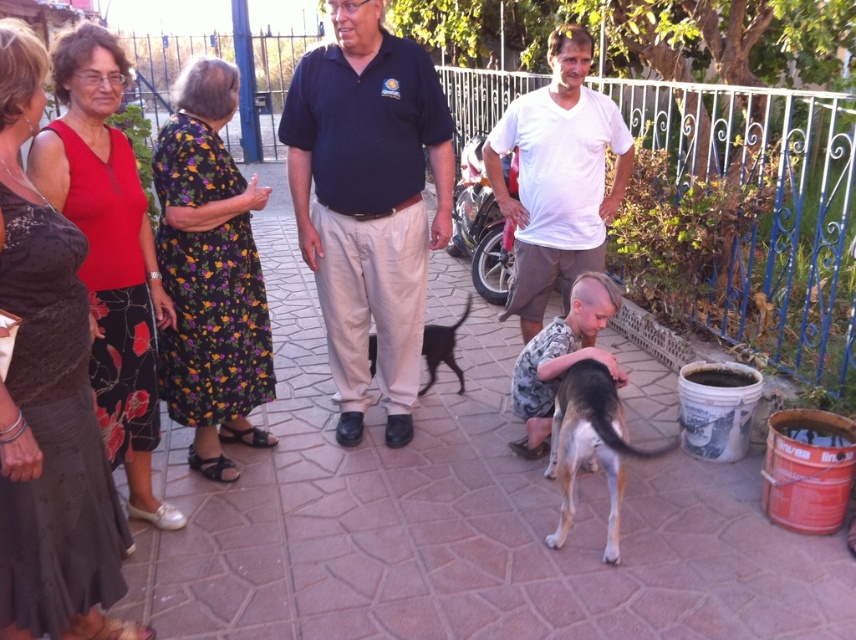
Question: Which of the following is the farthest from the observer?

Choices:
 (A) (215, 476)
 (B) (102, 484)
 (C) (438, 360)

Answer: (C)

Question: Is brown and white fur dog at lower center to the left of black leather sandal at lower left from the viewer's perspective?

Choices:
 (A) no
 (B) yes

Answer: (A)

Question: Which point is closer to the camera?

Choices:
 (A) black fabric sandal at lower left
 (B) white cotton shirt at center
 (C) black leather sandal at lower left
 (D) brown and white fur dog at lower center

Answer: (D)

Question: Is black floral skirt at left smaller than white cotton shirt at center?

Choices:
 (A) no
 (B) yes

Answer: (B)

Question: Based on their relative distances, which object is nearer to the dark blue cotton shirt at center?

Choices:
 (A) white cotton shirt at center
 (B) black leather sandal at lower left
 (C) brown and white fur dog at lower center
 (D) black fur dog at center

Answer: (D)

Question: Is white cotton shirt at center to the left of black fabric sandal at lower left from the viewer's perspective?

Choices:
 (A) no
 (B) yes

Answer: (A)